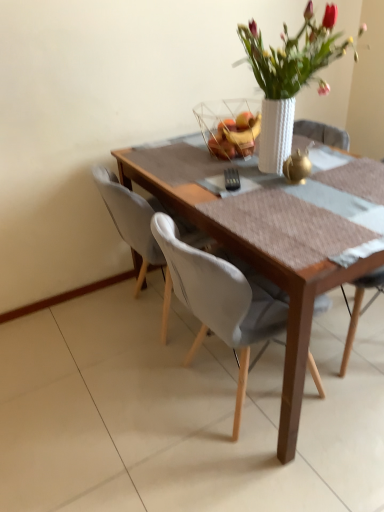
Question: Considering the relative positions of white textured vase at upper center and translucent glass bowl at center in the image provided, is white textured vase at upper center to the right of translucent glass bowl at center from the viewer's perspective?

Choices:
 (A) no
 (B) yes

Answer: (B)

Question: Is white textured vase at upper center wider than translucent glass bowl at center?

Choices:
 (A) no
 (B) yes

Answer: (B)

Question: From the image's perspective, is white textured vase at upper center above translucent glass bowl at center?

Choices:
 (A) yes
 (B) no

Answer: (A)

Question: Considering the relative positions of white textured vase at upper center and translucent glass bowl at center in the image provided, is white textured vase at upper center in front of translucent glass bowl at center?

Choices:
 (A) yes
 (B) no

Answer: (A)

Question: From a real-world perspective, is white textured vase at upper center over translucent glass bowl at center?

Choices:
 (A) yes
 (B) no

Answer: (A)

Question: From the image's perspective, is wooden table at center located above or below translucent glass bowl at center?

Choices:
 (A) below
 (B) above

Answer: (A)

Question: From a real-world perspective, is wooden table at center physically located above or below translucent glass bowl at center?

Choices:
 (A) above
 (B) below

Answer: (B)

Question: Would you say wooden table at center is inside or outside translucent glass bowl at center?

Choices:
 (A) outside
 (B) inside

Answer: (A)

Question: From their relative heights in the image, would you say wooden table at center is taller or shorter than translucent glass bowl at center?

Choices:
 (A) short
 (B) tall

Answer: (B)

Question: Considering the relative positions of wooden table at center and white textured vase at upper center in the image provided, is wooden table at center to the left or to the right of white textured vase at upper center?

Choices:
 (A) right
 (B) left

Answer: (B)

Question: Is wooden table at center wider or thinner than white textured vase at upper center?

Choices:
 (A) wide
 (B) thin

Answer: (A)

Question: From a real-world perspective, relative to white textured vase at upper center, is wooden table at center vertically above or below?

Choices:
 (A) above
 (B) below

Answer: (B)

Question: Is wooden table at center inside the boundaries of white textured vase at upper center, or outside?

Choices:
 (A) inside
 (B) outside

Answer: (B)

Question: Is point (127, 227) closer or farther from the camera than point (193, 222)?

Choices:
 (A) closer
 (B) farther

Answer: (B)

Question: From the image's perspective, relative to wooden table at center, is white fabric chair at center above or below?

Choices:
 (A) below
 (B) above

Answer: (B)